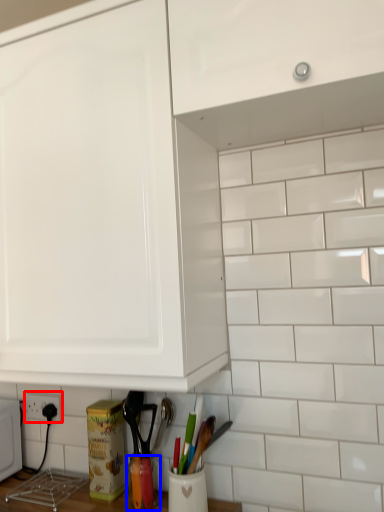
Question: Which point is closer to the camera, electric outlet (highlighted by a red box) or appliance (highlighted by a blue box)?

Choices:
 (A) electric outlet
 (B) appliance

Answer: (B)